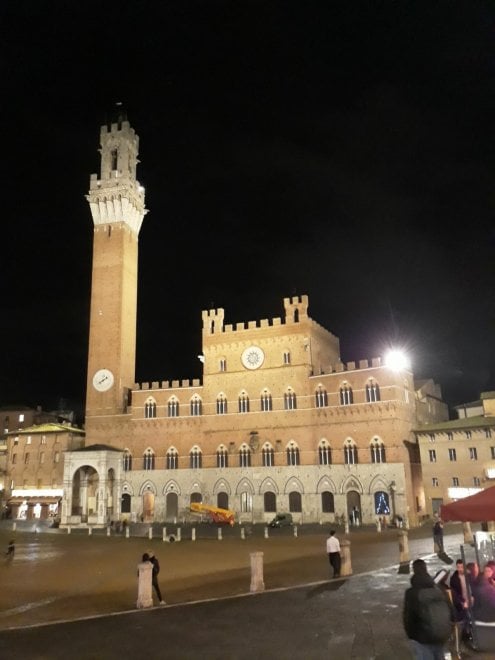
Where is `pillar`? Image resolution: width=495 pixels, height=660 pixels. pillar is located at coordinates (x=257, y=570).